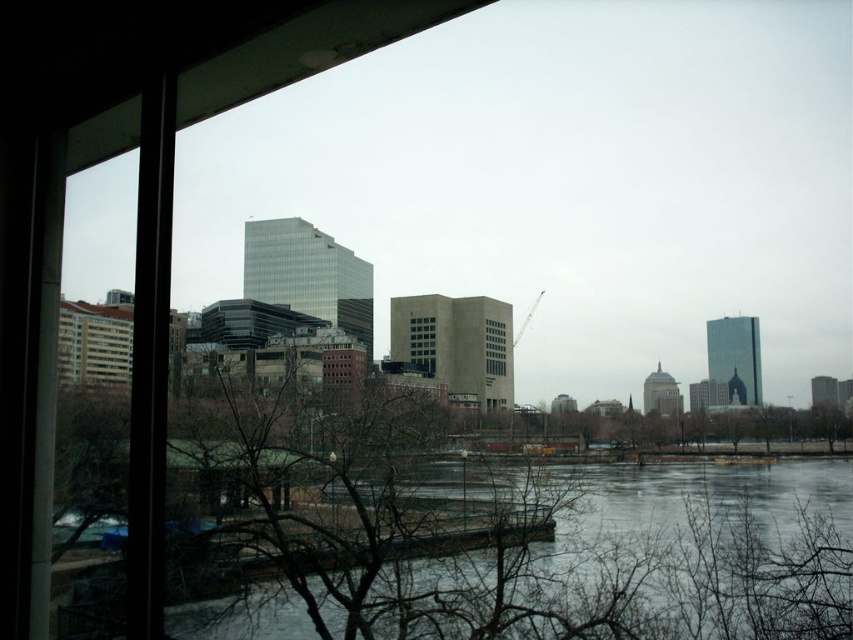
Is the position of matte glass building at center more distant than that of clear glass building at center?

No, matte glass building at center is closer to the viewer.

Locate an element on the screen. Image resolution: width=853 pixels, height=640 pixels. matte glass building at center is located at coordinates tap(422, 344).

Where is `matte glass building at center`? Image resolution: width=853 pixels, height=640 pixels. matte glass building at center is located at coordinates (422, 344).